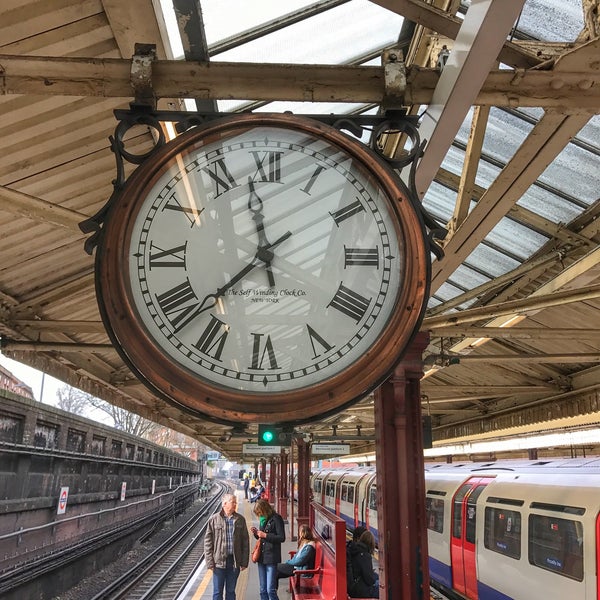
The image size is (600, 600). What are the coordinates of `coat` in the screenshot? It's located at (216, 539), (275, 548), (306, 556), (368, 567).